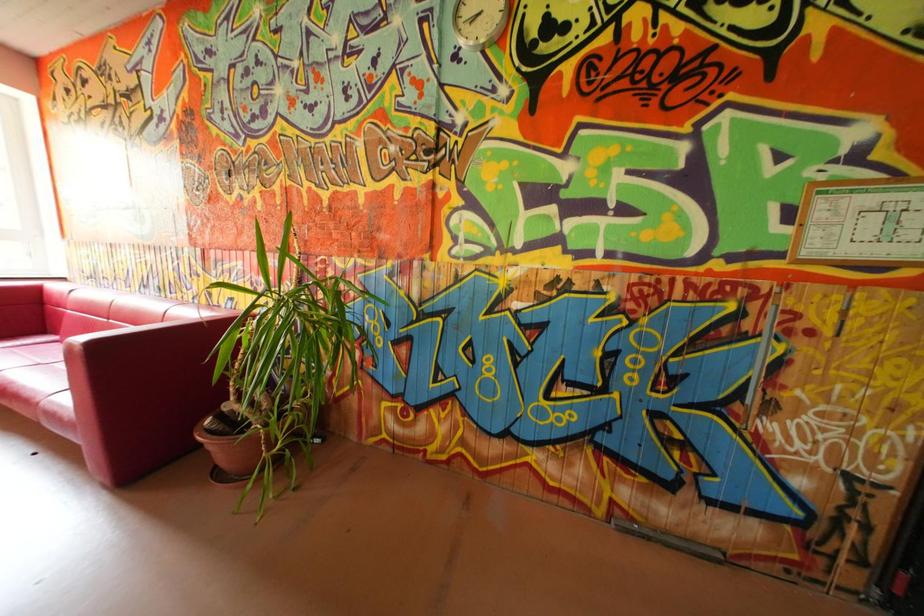
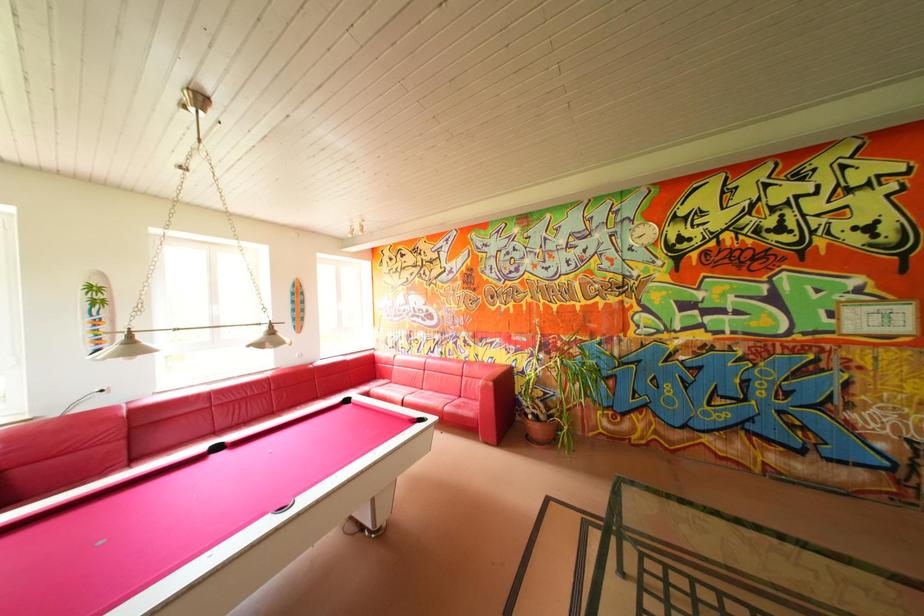
Looking at this image, which direction would the cameraman need to move to produce the second image?

The cameraman walked toward left, backward.